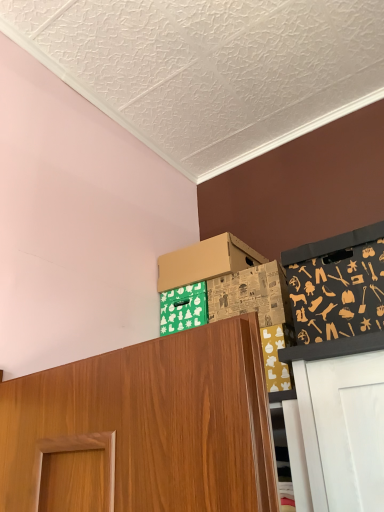
Question: Is cardboard box at upper center, the first box when ordered from front to back, positioned beyond the bounds of brown cardboard box at upper center, which ranks as the 2th box in front-to-back order?

Choices:
 (A) yes
 (B) no

Answer: (A)

Question: Is cardboard box at upper center, which is counted as the second box, starting from the back, beside brown cardboard box at upper center, arranged as the 1th box when viewed from the back?

Choices:
 (A) no
 (B) yes

Answer: (A)

Question: Considering the relative sizes of cardboard box at upper center, which is counted as the second box, starting from the back, and brown cardboard box at upper center, arranged as the 1th box when viewed from the back, in the image provided, is cardboard box at upper center, which is counted as the second box, starting from the back, shorter than brown cardboard box at upper center, arranged as the 1th box when viewed from the back,?

Choices:
 (A) yes
 (B) no

Answer: (B)

Question: From the image's perspective, is cardboard box at upper center, which is counted as the second box, starting from the back, under brown cardboard box at upper center, arranged as the 1th box when viewed from the back?

Choices:
 (A) no
 (B) yes

Answer: (B)

Question: Does cardboard box at upper center, which is counted as the second box, starting from the back, lie in front of brown cardboard box at upper center, which ranks as the 2th box in front-to-back order?

Choices:
 (A) yes
 (B) no

Answer: (A)

Question: Is point (223, 271) positioned closer to the camera than point (213, 295)?

Choices:
 (A) farther
 (B) closer

Answer: (A)

Question: Is brown cardboard box at upper center, which ranks as the 2th box in front-to-back order, inside or outside of cardboard box at upper center, which is counted as the second box, starting from the back?

Choices:
 (A) inside
 (B) outside

Answer: (B)

Question: In terms of width, does brown cardboard box at upper center, arranged as the 1th box when viewed from the back, look wider or thinner when compared to cardboard box at upper center, which is counted as the second box, starting from the back?

Choices:
 (A) wide
 (B) thin

Answer: (A)

Question: From their relative heights in the image, would you say brown cardboard box at upper center, which ranks as the 2th box in front-to-back order, is taller or shorter than cardboard box at upper center, which is counted as the second box, starting from the back?

Choices:
 (A) short
 (B) tall

Answer: (A)

Question: From their relative heights in the image, would you say black fabric with tool patterns at upper right is taller or shorter than cardboard box at upper center, which is counted as the second box, starting from the back?

Choices:
 (A) short
 (B) tall

Answer: (B)

Question: Considering the positions of black fabric with tool patterns at upper right and cardboard box at upper center, which is counted as the second box, starting from the back, in the image, is black fabric with tool patterns at upper right bigger or smaller than cardboard box at upper center, which is counted as the second box, starting from the back,?

Choices:
 (A) small
 (B) big

Answer: (B)

Question: Would you say black fabric with tool patterns at upper right is inside or outside cardboard box at upper center, which is counted as the second box, starting from the back?

Choices:
 (A) outside
 (B) inside

Answer: (A)

Question: From a real-world perspective, is black fabric with tool patterns at upper right positioned above or below cardboard box at upper center, the first box when ordered from front to back?

Choices:
 (A) above
 (B) below

Answer: (B)

Question: From a real-world perspective, is brown cardboard box at upper center, arranged as the 1th box when viewed from the back, above or below black fabric with tool patterns at upper right?

Choices:
 (A) below
 (B) above

Answer: (B)

Question: Is brown cardboard box at upper center, arranged as the 1th box when viewed from the back, spatially inside black fabric with tool patterns at upper right, or outside of it?

Choices:
 (A) outside
 (B) inside

Answer: (A)